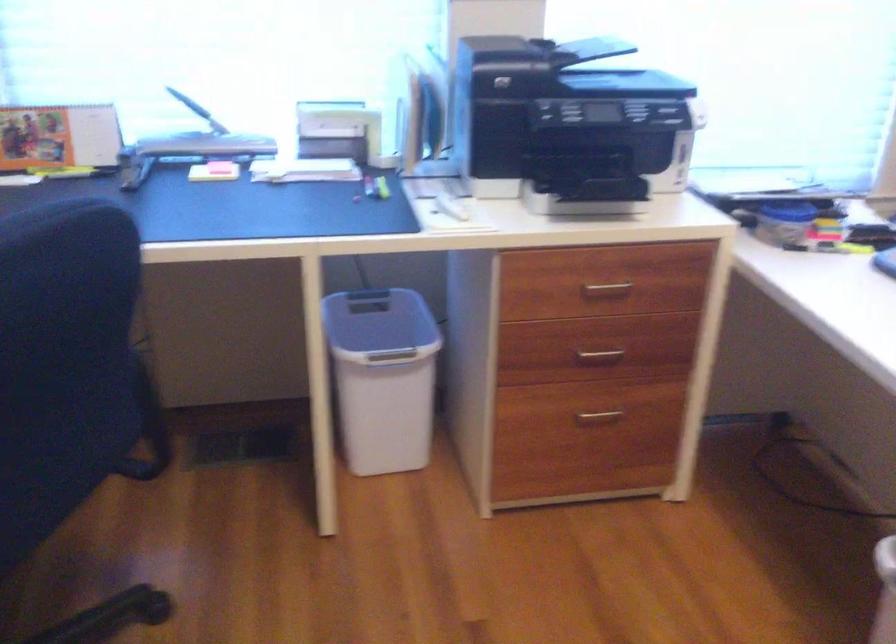
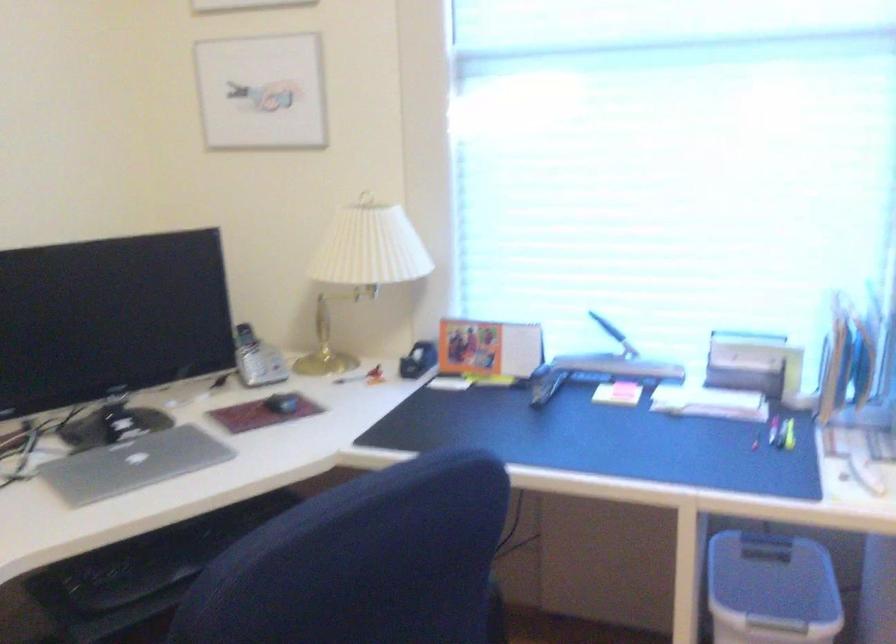
Find the pixel in the second image that matches [188,102] in the first image.

(607, 327)